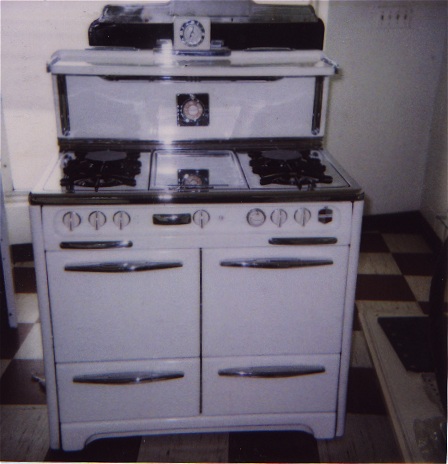
Image resolution: width=448 pixels, height=464 pixels. I want to click on light switch, so (x=391, y=17).